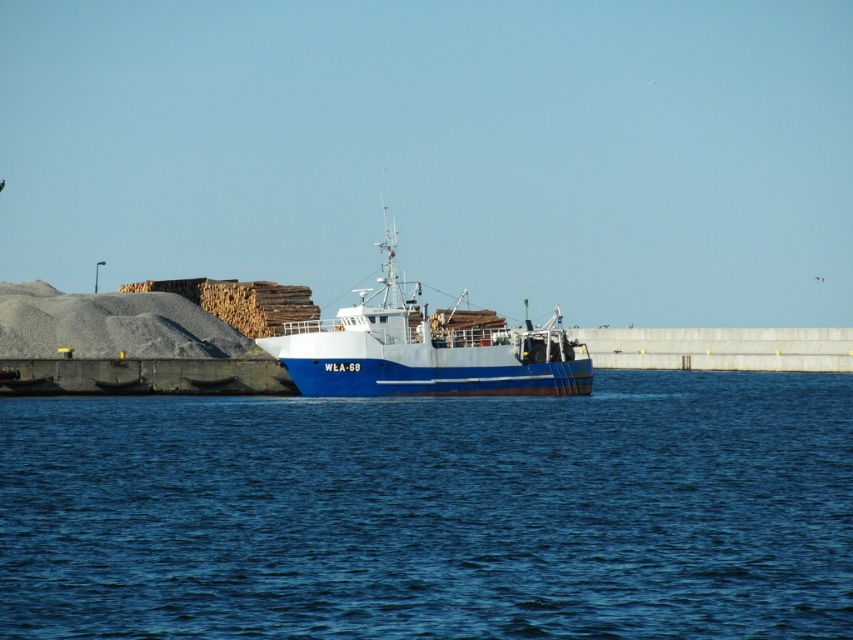
In the scene shown: You are a photographer planning to take a wide shot of the blue matte boat at center and the blue water at center. Given the spatial relationship between them, which object should you position closer to the edge of your camera frame to ensure both fit within the shot?

Since the blue water at center is wider than the blue matte boat at center, you should position the blue water at center closer to the edge of your camera frame to ensure both fit within the shot.

You are a maritime engineer assessing the cargo ship WLA 68. You see the blue water at center and the blue matte boat at center. Which object occupies a larger area in the image?

The blue matte boat at center occupies a larger area than the blue water at center, as the blue water at center is smaller than the blue matte boat at center.